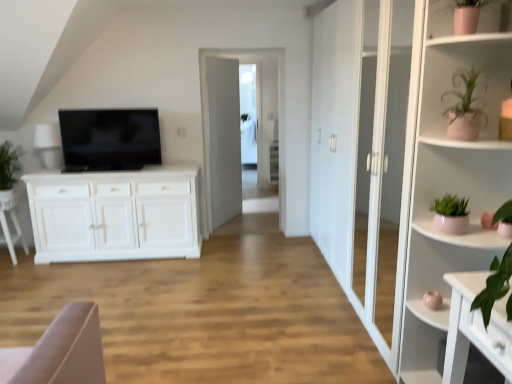
Find the location of a particular element. The height and width of the screenshot is (384, 512). vacant space in front of transparent glass door at center is located at coordinates (246, 240).